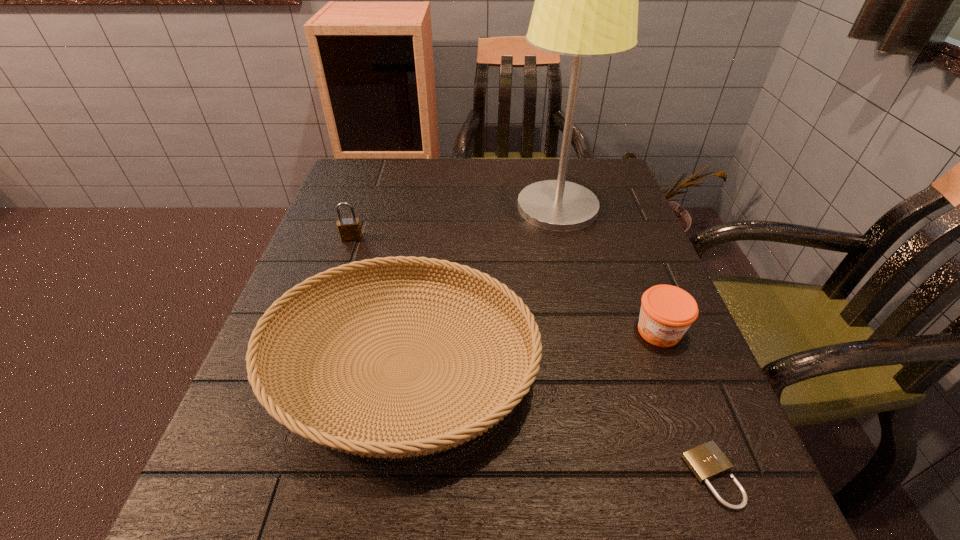
Where is `object located in the far right corner section of the desktop`? The height and width of the screenshot is (540, 960). object located in the far right corner section of the desktop is located at coordinates (586, 0).

The height and width of the screenshot is (540, 960). What are the coordinates of `object that is positioned at the near right corner` in the screenshot? It's located at (706, 461).

Identify the location of vacant space at the far edge of the desktop. The image size is (960, 540). (498, 173).

In the image, there is a desktop. Where is `free space at the near edge`? The height and width of the screenshot is (540, 960). free space at the near edge is located at coordinates (390, 519).

Identify the location of free point at the left edge. (259, 456).

In the image, there is a desktop. In order to click on vacant area at the right edge in this screenshot , I will do `click(580, 242)`.

This screenshot has height=540, width=960. In order to click on free space at the far left corner in this screenshot , I will do `click(391, 190)`.

Locate an element on the screen. blank region between the farthest object and the right padlock is located at coordinates [635, 341].

Image resolution: width=960 pixels, height=540 pixels. Identify the location of unoccupied area between the farther padlock and the second shortest object. (505, 285).

Find the location of `free area in between the shortest object and the table lamp`. free area in between the shortest object and the table lamp is located at coordinates point(635,341).